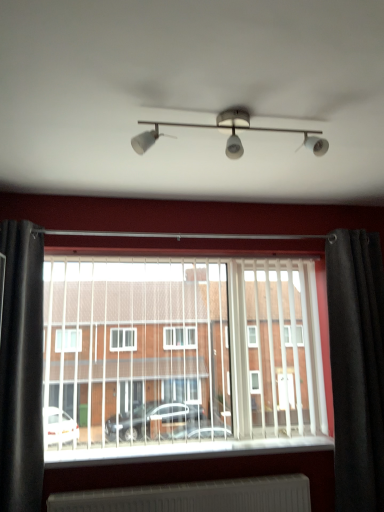
Question: From a real-world perspective, is satin white track lights at center positioned over white plastic window sill at center based on gravity?

Choices:
 (A) yes
 (B) no

Answer: (A)

Question: Is satin white track lights at center placed right next to white plastic window sill at center?

Choices:
 (A) no
 (B) yes

Answer: (A)

Question: Is satin white track lights at center in front of white plastic window sill at center?

Choices:
 (A) no
 (B) yes

Answer: (B)

Question: Is satin white track lights at center positioned behind white plastic window sill at center?

Choices:
 (A) yes
 (B) no

Answer: (B)

Question: Is white plastic window sill at center at the back of satin white track lights at center?

Choices:
 (A) no
 (B) yes

Answer: (A)

Question: Is satin white track lights at center bigger than white plastic window sill at center?

Choices:
 (A) no
 (B) yes

Answer: (A)

Question: From the image's perspective, is black velvet curtain at right, which ranks as the second curtain in left-to-right order, over satin white track lights at center?

Choices:
 (A) no
 (B) yes

Answer: (A)

Question: Is black velvet curtain at right, which ranks as the second curtain in left-to-right order, turned away from satin white track lights at center?

Choices:
 (A) yes
 (B) no

Answer: (B)

Question: Is black velvet curtain at right, which ranks as the second curtain in left-to-right order, positioned far away from satin white track lights at center?

Choices:
 (A) yes
 (B) no

Answer: (A)

Question: Could you tell me if black velvet curtain at right, which ranks as the second curtain in left-to-right order, is facing satin white track lights at center?

Choices:
 (A) no
 (B) yes

Answer: (A)

Question: Can you confirm if black velvet curtain at right, marked as the first curtain in a right-to-left arrangement, is shorter than satin white track lights at center?

Choices:
 (A) no
 (B) yes

Answer: (A)

Question: Is black velvet curtain at right, marked as the first curtain in a right-to-left arrangement, surrounding satin white track lights at center?

Choices:
 (A) no
 (B) yes

Answer: (A)

Question: Is black velvet curtain at right, which ranks as the second curtain in left-to-right order, to the right of black fabric curtain at left, the first curtain viewed from the left, from the viewer's perspective?

Choices:
 (A) yes
 (B) no

Answer: (A)